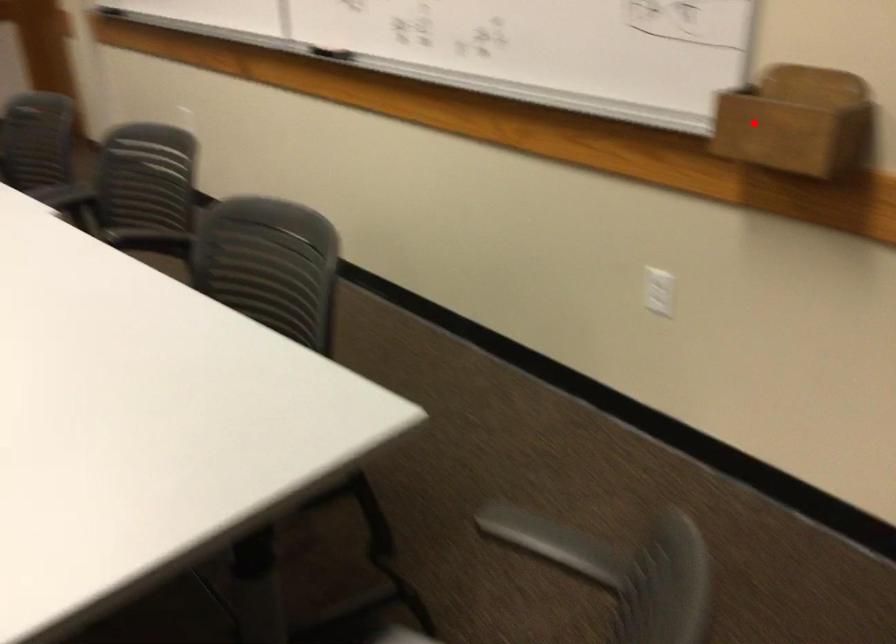
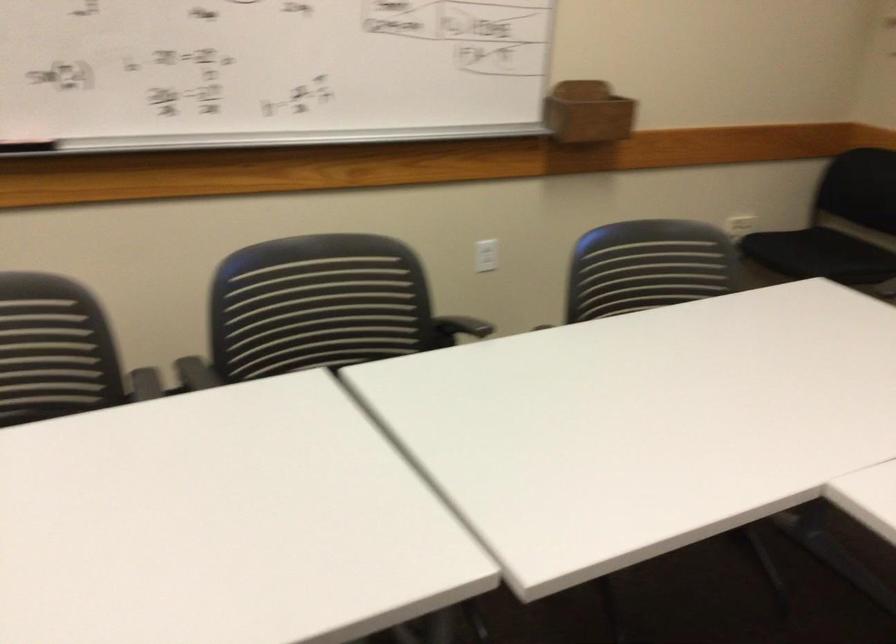
Question: I am providing you with two images of the same scene from different viewpoints. Image1 has a red point marked. In image2, the corresponding 3D location appears at what relative position? Reply with the corresponding letter.

Choices:
 (A) Closer
 (B) Farther

Answer: (B)